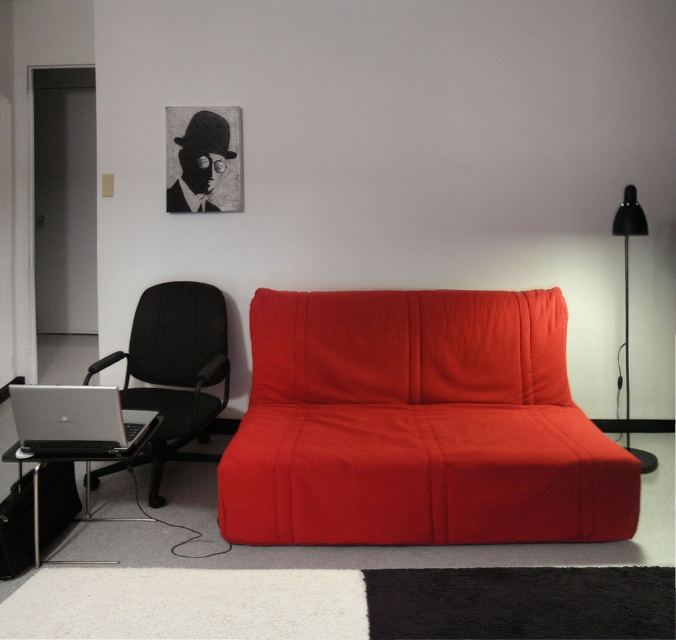
Is black mesh swivel chair at left to the left of black matte floor lamp at right from the viewer's perspective?

Correct, you'll find black mesh swivel chair at left to the left of black matte floor lamp at right.

This screenshot has width=676, height=640. What do you see at coordinates (174, 369) in the screenshot? I see `black mesh swivel chair at left` at bounding box center [174, 369].

The image size is (676, 640). I want to click on black mesh swivel chair at left, so click(x=174, y=369).

Can you confirm if black mesh swivel chair at left is wider than silver metallic laptop at left?

Yes, black mesh swivel chair at left is wider than silver metallic laptop at left.

The height and width of the screenshot is (640, 676). Find the location of `black mesh swivel chair at left`. black mesh swivel chair at left is located at coordinates (174, 369).

Can you confirm if matte red couch at center is bigger than black matte floor lamp at right?

Yes, matte red couch at center is bigger than black matte floor lamp at right.

Is point (521, 442) farther from viewer compared to point (642, 465)?

No, it is in front of (642, 465).

Where is `matte red couch at center`? Image resolution: width=676 pixels, height=640 pixels. matte red couch at center is located at coordinates 416,426.